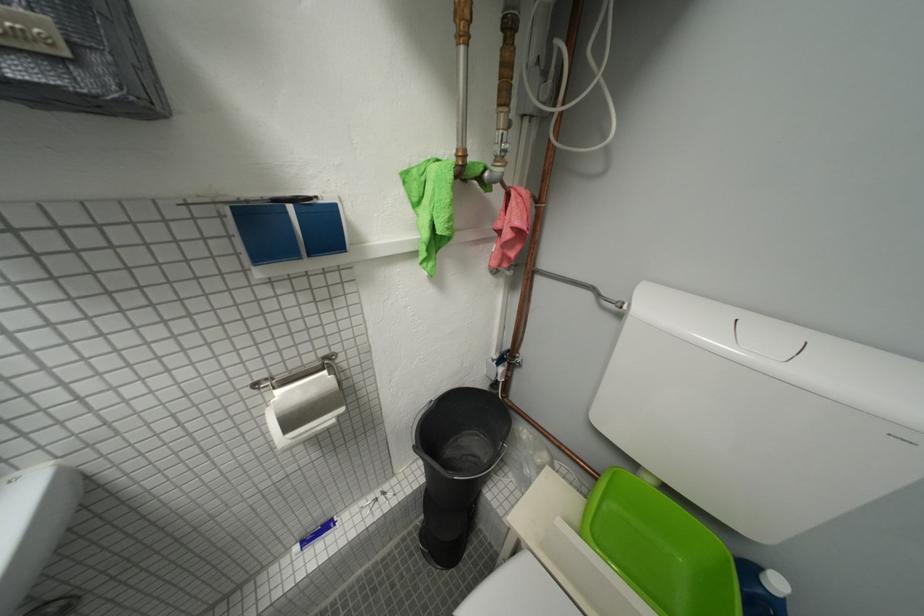
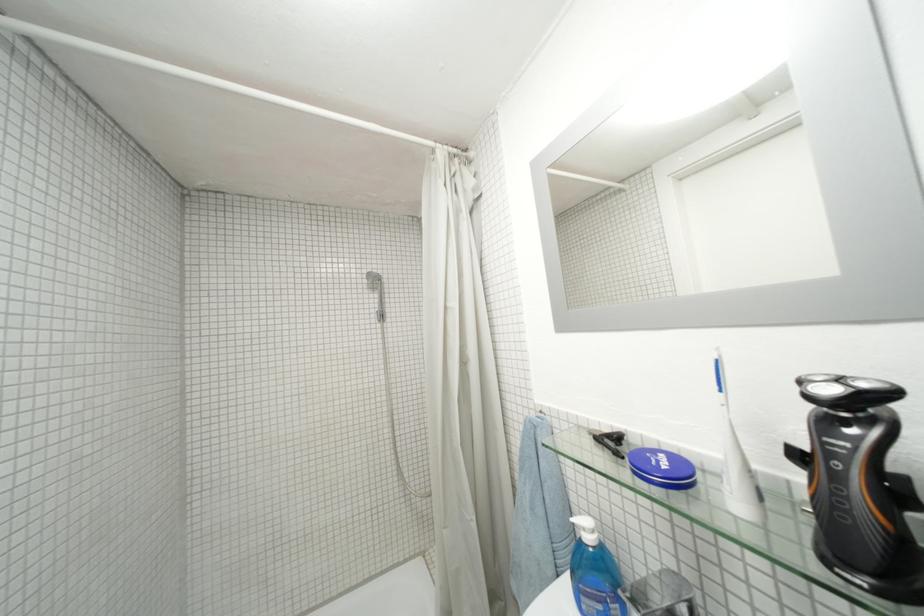
Question: The camera is either moving clockwise (left) or counter-clockwise (right) around the object. The first image is from the beginning of the video and the second image is from the end. Is the camera moving left or right when shooting the video?

Choices:
 (A) Left
 (B) Right

Answer: (B)